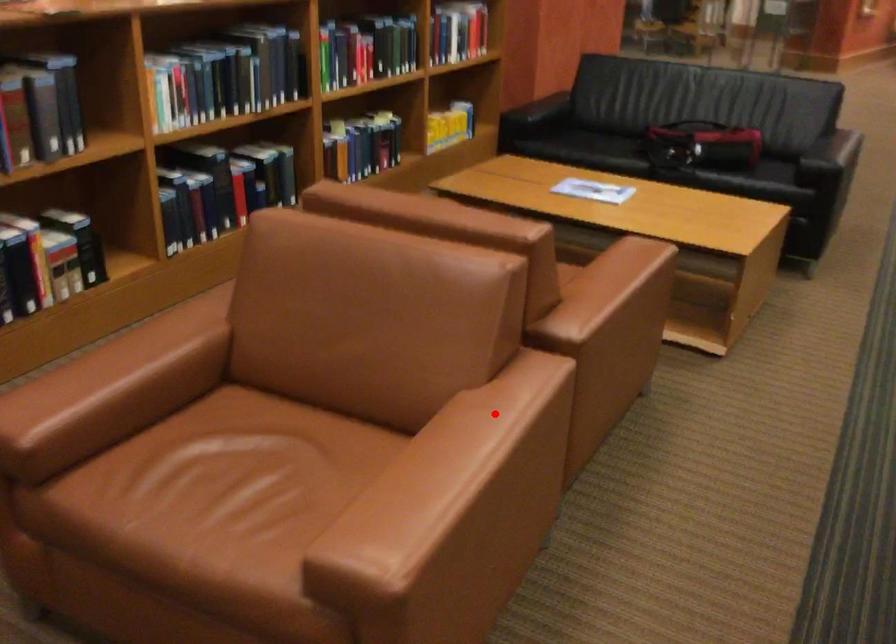
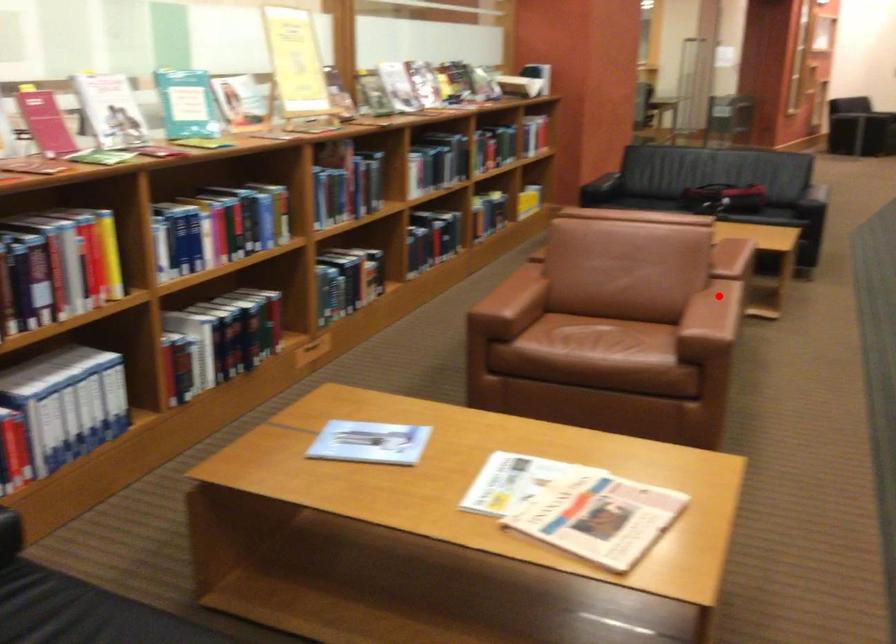
I am providing you with two images of the same scene from different viewpoints. A red point is marked on the first image and another point is marked on the second image. Does the point marked in image1 correspond to the same location as the one in image2?

Yes